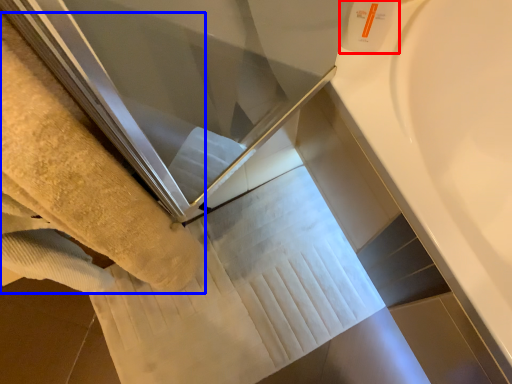
Question: Which of the following is the farthest to the observer, toiletry (highlighted by a red box) or towel (highlighted by a blue box)?

Choices:
 (A) toiletry
 (B) towel

Answer: (A)